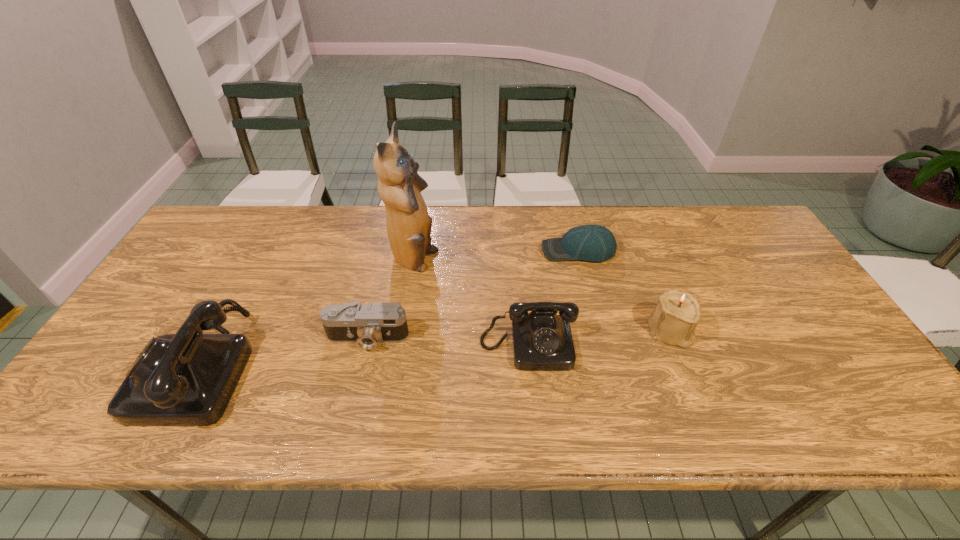
Locate an element on the screen. free space located on the dial of the left telephone is located at coordinates (118, 364).

The height and width of the screenshot is (540, 960). I want to click on free location located 0.050m on the dial of the third shortest object, so click(532, 390).

Where is `vacant region located on the face of the tallest object`? vacant region located on the face of the tallest object is located at coordinates (501, 261).

Identify the location of vacant space located on the right of the baseball cap. Image resolution: width=960 pixels, height=540 pixels. (632, 251).

At what (x,y) coordinates should I click in order to perform the action: click on vacant space situated 0.110m on the left of the rightmost object. Please return your answer as a coordinate pair (x, y). Looking at the image, I should click on (606, 332).

You are a GUI agent. You are given a task and a screenshot of the screen. Output one action in this format:
    pyautogui.click(x=<x>, y=<y>)
    Task: Click on the cat at the far edge
    This screenshot has height=540, width=960.
    Given the screenshot: What is the action you would take?
    pyautogui.click(x=399, y=185)

At what (x,y) coordinates should I click in order to perform the action: click on baseball cap at the far edge. Please return your answer as a coordinate pair (x, y). The width and height of the screenshot is (960, 540). Looking at the image, I should click on (595, 243).

The height and width of the screenshot is (540, 960). In order to click on object located at the left edge in this screenshot , I will do `click(185, 379)`.

Identify the location of object situated at the near left corner. The width and height of the screenshot is (960, 540). (185, 379).

Identify the location of free space at the far edge of the desktop. (538, 239).